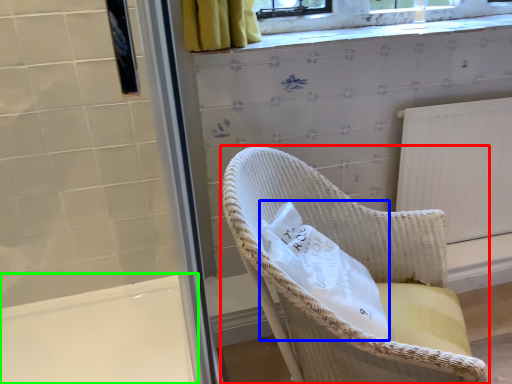
Question: Considering the real-world distances, which object is farthest from chair (highlighted by a red box)? material (highlighted by a blue box) or bath (highlighted by a green box)?

Choices:
 (A) material
 (B) bath

Answer: (B)